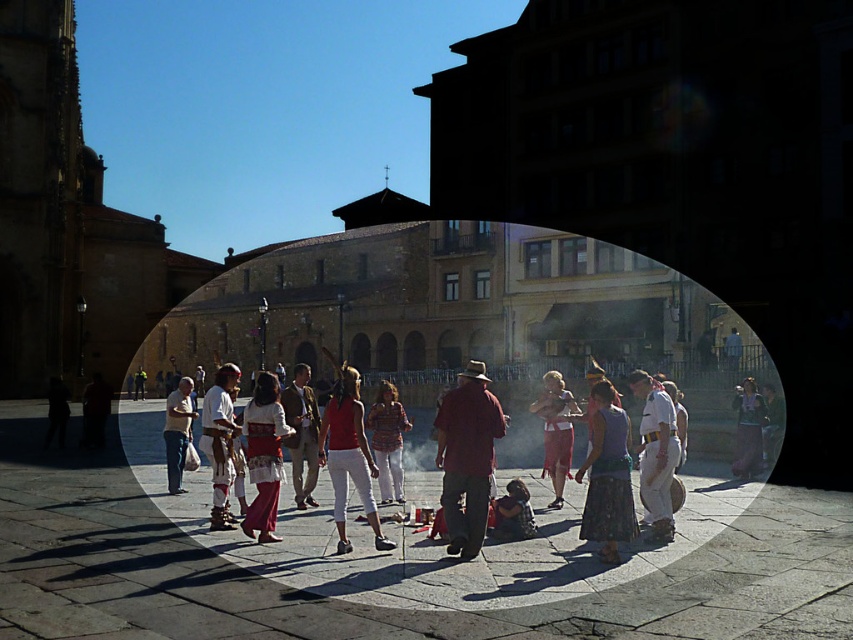
You are a photographer at the public square and want to capture the traditional dance performance. You notice the matte red skirt at center and the embroidered fabric dress at center. Which clothing item is covering part of the other?

The matte red skirt at center is positioned over the embroidered fabric dress at center, so it is covering part of the dress.

You are a photographer positioned at the edge of the square, aiming to capture both the matte red skirt at center and the embroidered fabric dress at center in a single shot. Which object should you adjust your camera to focus on first if you want to ensure both are in frame?

The matte red skirt at center is to the left of the embroidered fabric dress at center. To ensure both are in frame, focus on the embroidered fabric dress at center first since it is on the right side, allowing you to adjust the camera to include the leftward positioned matte red skirt at center.